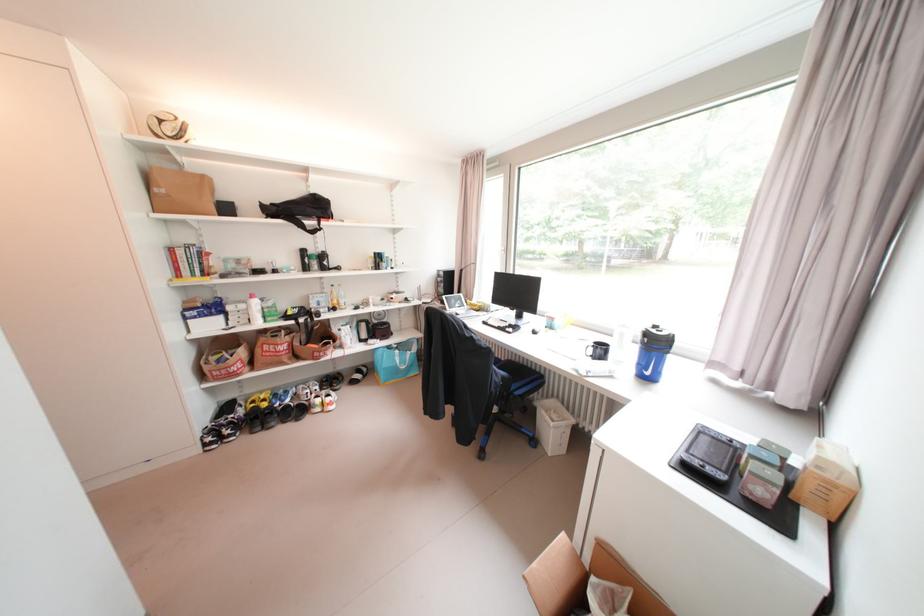
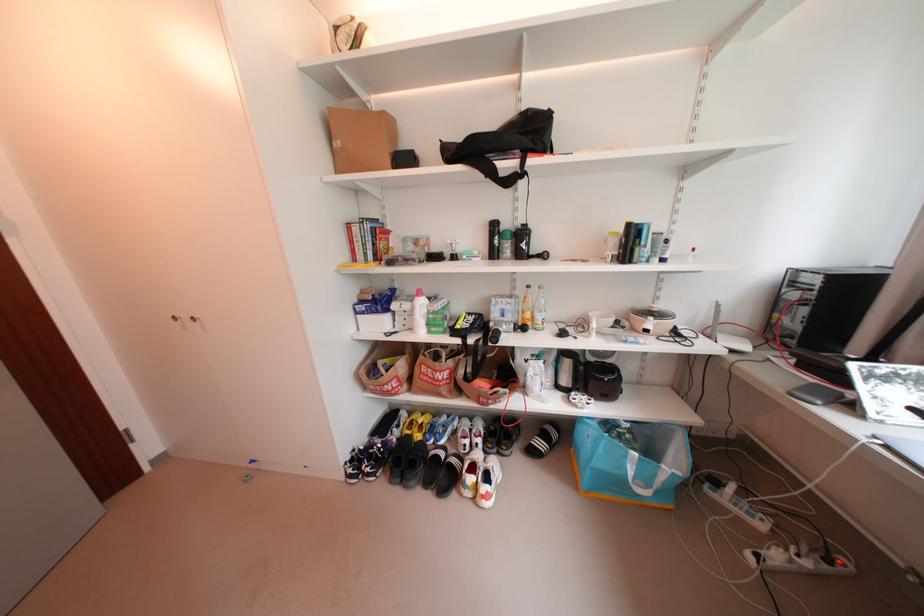
Where in the second image is the point corresponding to pixel 342 294 from the first image?

(536, 301)